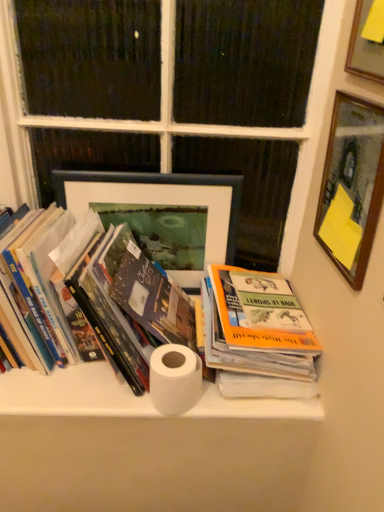
The image size is (384, 512). I want to click on free location to the right of white matte toilet paper at center, so click(247, 400).